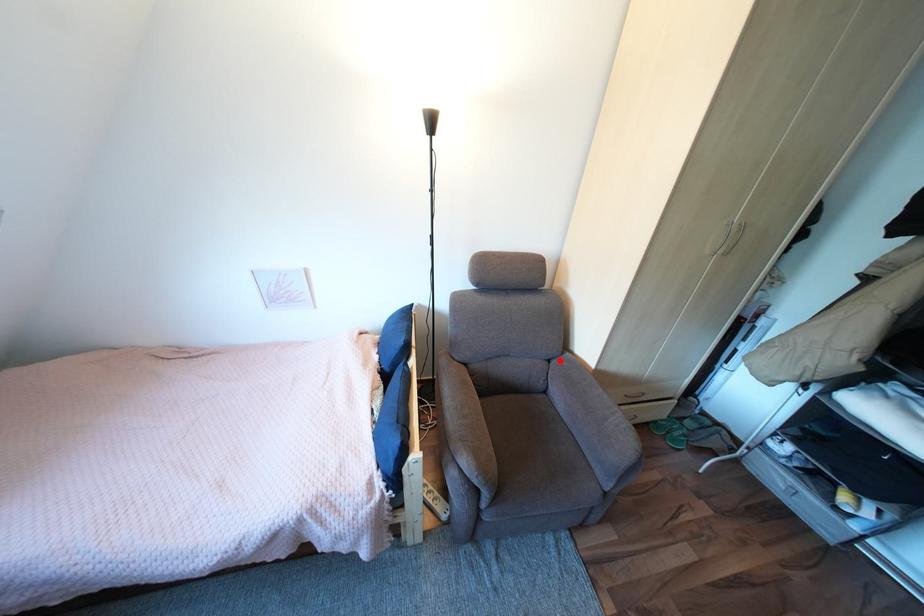
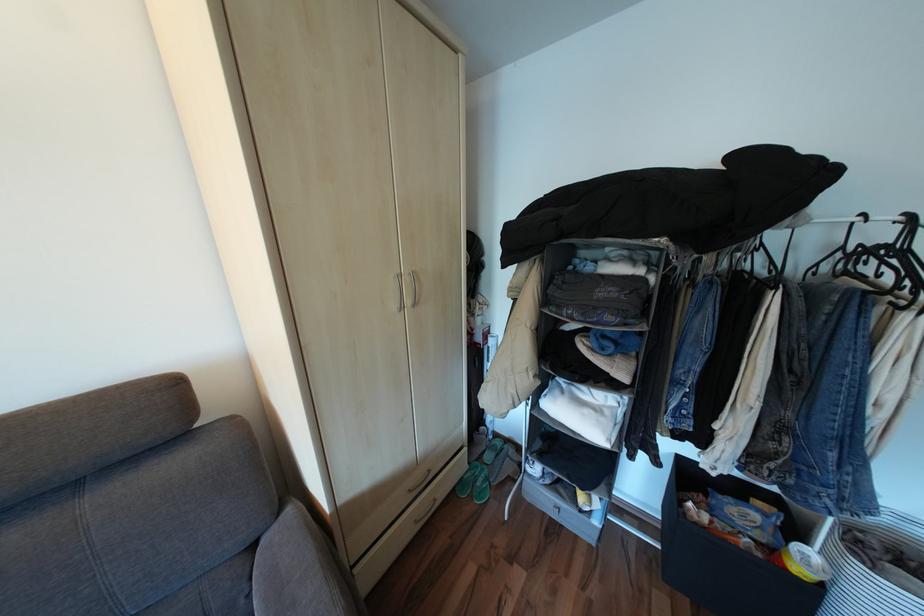
In the second image, find the point that corresponds to the highlighted location in the first image.

(263, 545)